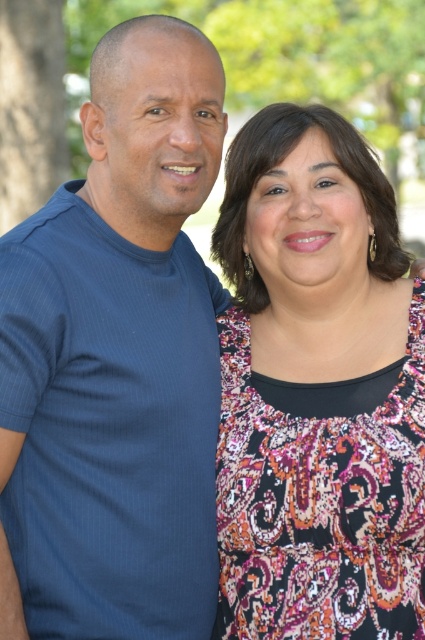
Question: Among these points, which one is farthest from the camera?

Choices:
 (A) (31, 141)
 (B) (354, 417)

Answer: (A)

Question: Does printed fabric blouse at center have a lesser width compared to blue ribbed t-shirt at left?

Choices:
 (A) no
 (B) yes

Answer: (A)

Question: Is printed fabric blouse at center above blue ribbed t-shirt at left?

Choices:
 (A) yes
 (B) no

Answer: (B)

Question: Estimate the real-world distances between objects in this image. Which object is closer to the green leafy tree at left?

Choices:
 (A) blue ribbed t-shirt at left
 (B) printed fabric blouse at center

Answer: (B)

Question: Where is printed fabric blouse at center located in relation to blue ribbed t-shirt at left in the image?

Choices:
 (A) right
 (B) left

Answer: (A)

Question: Among these objects, which one is nearest to the camera?

Choices:
 (A) blue ribbed t-shirt at left
 (B) printed fabric blouse at center

Answer: (A)